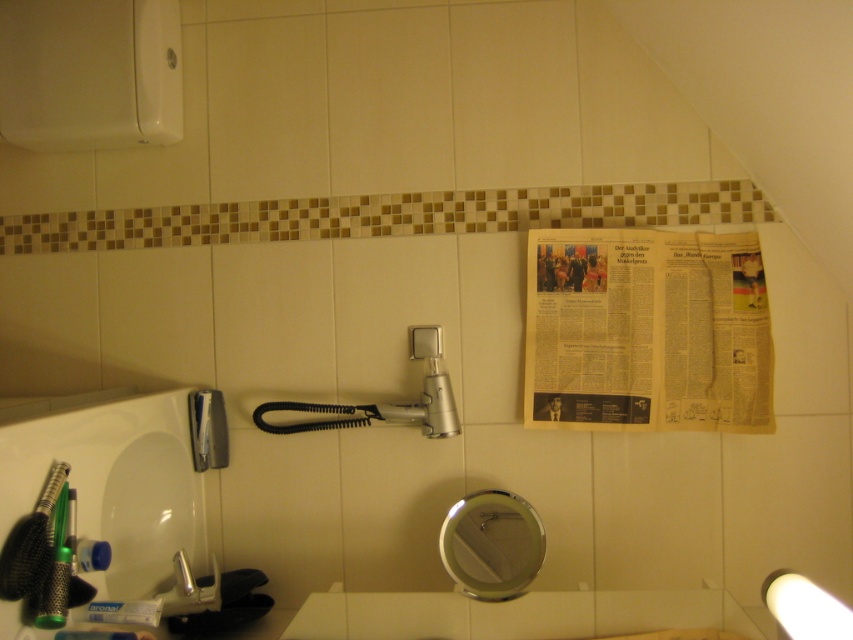
Question: Which object is the farthest from the white matte toothpaste at lower left?

Choices:
 (A) yellowed newspaper at upper right
 (B) white plastic toothpaste at lower left
 (C) white glossy sink at lower left

Answer: (A)

Question: Which of these objects is positioned farthest from the yellowed newspaper at upper right?

Choices:
 (A) white matte toothpaste at lower left
 (B) white glossy sink at lower left

Answer: (A)

Question: Which object is closer to the camera taking this photo?

Choices:
 (A) white matte toothpaste at lower left
 (B) white glossy sink at lower left
 (C) yellowed newspaper at upper right
 (D) white plastic toothpaste at lower left

Answer: (B)

Question: Does white glossy sink at lower left appear on the right side of white matte toothpaste at lower left?

Choices:
 (A) no
 (B) yes

Answer: (A)

Question: Does white glossy sink at lower left lie in front of white matte toothpaste at lower left?

Choices:
 (A) no
 (B) yes

Answer: (B)

Question: Can you confirm if yellowed newspaper at upper right is positioned below white plastic toothpaste at lower left?

Choices:
 (A) no
 (B) yes

Answer: (A)